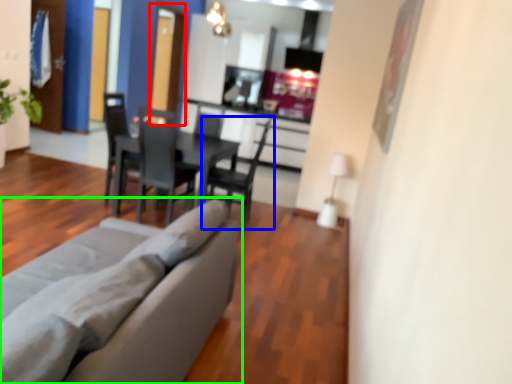
Question: Which object is the closest to the glass door (highlighted by a red box)? Choose among these: chair (highlighted by a blue box) or studio couch (highlighted by a green box).

Choices:
 (A) chair
 (B) studio couch

Answer: (A)